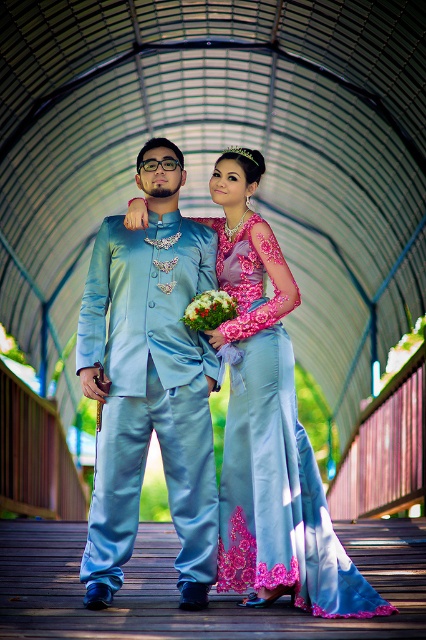
Consider the image. You are a photographer positioned in front of the wooden bridge. You notice the satin light blue suit at center and the green floral bouquet at center. Which object is nearer to your camera lens?

The satin light blue suit at center is closer to the viewer than the green floral bouquet at center, so the satin light blue suit at center is nearer to the camera lens.

You are a photographer taking a picture of the couple. You want to ensure the satin blue suit at center and the green floral bouquet at center are both clearly visible. Which object should you focus on first to make sure both are in focus?

The satin blue suit at center is in front of the green floral bouquet at center, so you should focus on the satin blue suit at center first to ensure both are in focus.